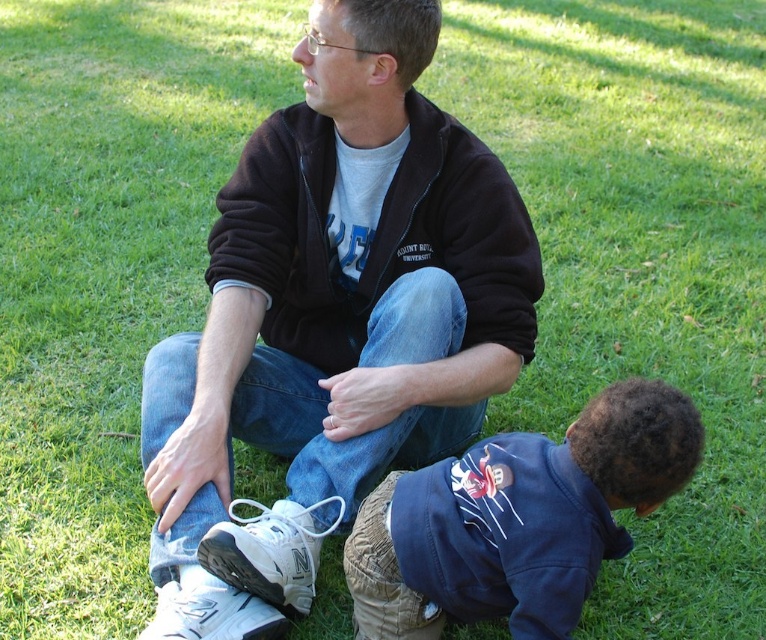
You are a clothing designer who wants to create a matching outfit for both the adult and the child. Given the sizes of the matte black jacket at center and the dark blue fleece at lower right, which jacket should be used as the base design for the adult?

The matte black jacket at center has a larger size compared to the dark blue fleece at lower right, so the matte black jacket at center should be used as the base design for the adult since it is bigger and more suitable for an adult.

Looking at this image, you are a photographer trying to capture a candid shot of the two people in the scene. You want to ensure both the dark blue fleece at lower right and the black fleece sweatshirt at center are clearly visible in your photo. Based on their positions, which fleece should you focus on first to ensure it doesn

The dark blue fleece at lower right has a lesser height compared to the black fleece sweatshirt at center. Since it is shorter, you should focus on the dark blue fleece at lower right first to ensure it doesn